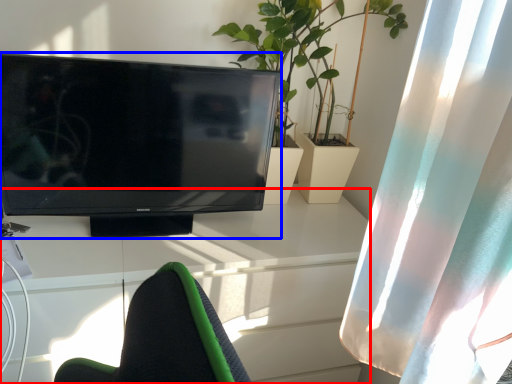
Question: Which object is further to the camera taking this photo, desk (highlighted by a red box) or television (highlighted by a blue box)?

Choices:
 (A) desk
 (B) television

Answer: (A)